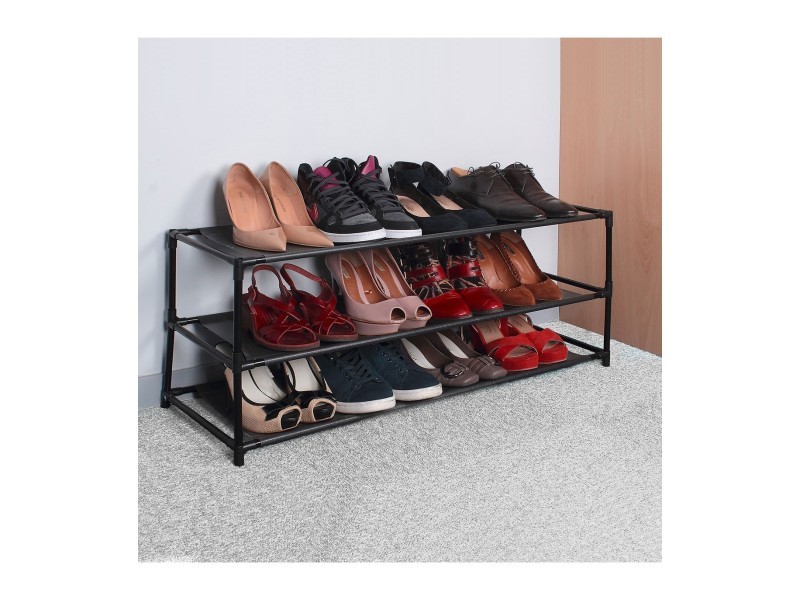
Locate an element on the screen. shoe on top shelf is located at coordinates (254, 203), (292, 199), (330, 193), (374, 193), (417, 206), (448, 203), (500, 194), (532, 189).